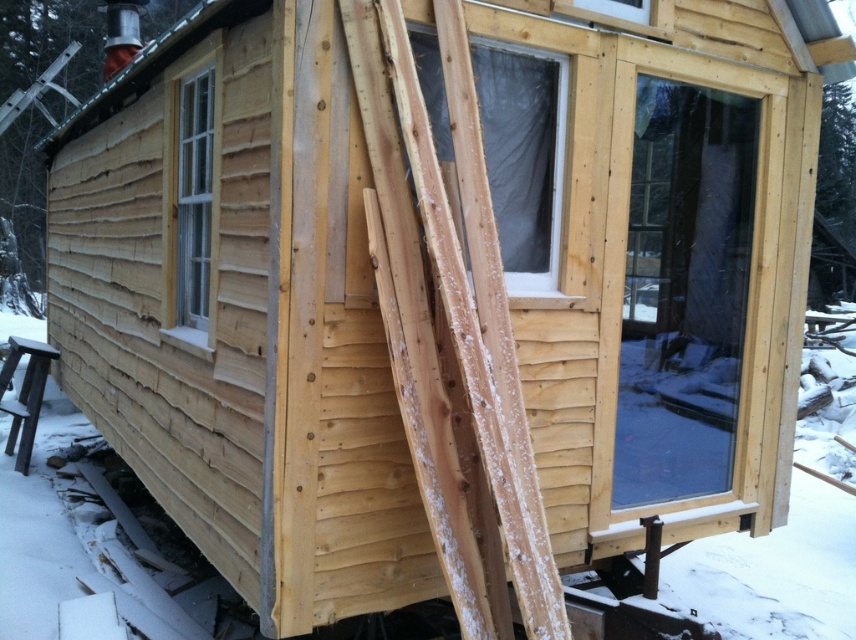
Question: Which object is positioned closest to the transparent glass door at right?

Choices:
 (A) clear glass window at left
 (B) clear plastic window at center

Answer: (B)

Question: Can you confirm if clear plastic window at center is positioned above clear glass window at left?

Choices:
 (A) yes
 (B) no

Answer: (A)

Question: Is transparent glass door at right wider than clear plastic window at center?

Choices:
 (A) no
 (B) yes

Answer: (B)

Question: Among these objects, which one is nearest to the camera?

Choices:
 (A) clear plastic window at center
 (B) transparent glass door at right
 (C) clear glass window at left

Answer: (A)

Question: Estimate the real-world distances between objects in this image. Which object is closer to the transparent glass door at right?

Choices:
 (A) clear glass window at left
 (B) clear plastic window at center

Answer: (B)

Question: Does transparent glass door at right appear over clear glass window at left?

Choices:
 (A) no
 (B) yes

Answer: (A)